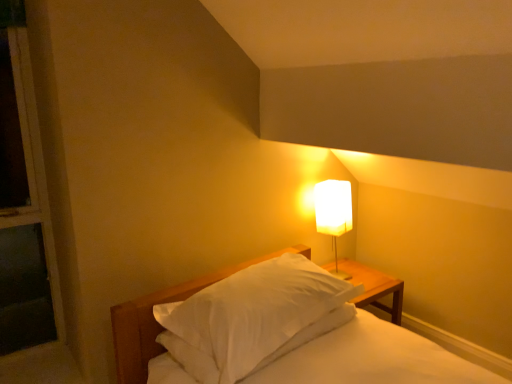
Question: Is white soft pillow at center surrounded by white fabric lampshade at upper right?

Choices:
 (A) yes
 (B) no

Answer: (B)

Question: Does white fabric lampshade at upper right have a lesser height compared to white soft pillow at center?

Choices:
 (A) yes
 (B) no

Answer: (B)

Question: From a real-world perspective, is white fabric lampshade at upper right on top of white soft pillow at center?

Choices:
 (A) no
 (B) yes

Answer: (B)

Question: Can you confirm if white fabric lampshade at upper right is taller than white soft pillow at center?

Choices:
 (A) yes
 (B) no

Answer: (A)

Question: Does white fabric lampshade at upper right have a smaller size compared to white soft pillow at center?

Choices:
 (A) no
 (B) yes

Answer: (B)

Question: Is white fabric lampshade at upper right bigger than white soft pillow at center?

Choices:
 (A) no
 (B) yes

Answer: (A)

Question: Is the position of white soft pillow at center more distant than that of white fabric lampshade at upper right?

Choices:
 (A) yes
 (B) no

Answer: (B)

Question: Is white soft pillow at center completely or partially outside of white fabric lampshade at upper right?

Choices:
 (A) yes
 (B) no

Answer: (A)

Question: From the image's perspective, does white soft pillow at center appear lower than white fabric lampshade at upper right?

Choices:
 (A) no
 (B) yes

Answer: (B)

Question: From a real-world perspective, is white soft pillow at center located beneath white fabric lampshade at upper right?

Choices:
 (A) no
 (B) yes

Answer: (B)

Question: From the image's perspective, does white soft pillow at center appear higher than white fabric lampshade at upper right?

Choices:
 (A) no
 (B) yes

Answer: (A)

Question: Is white soft pillow at center beside white fabric lampshade at upper right?

Choices:
 (A) yes
 (B) no

Answer: (B)

Question: Is white matte bed at center positioned behind white fabric lampshade at upper right?

Choices:
 (A) yes
 (B) no

Answer: (B)